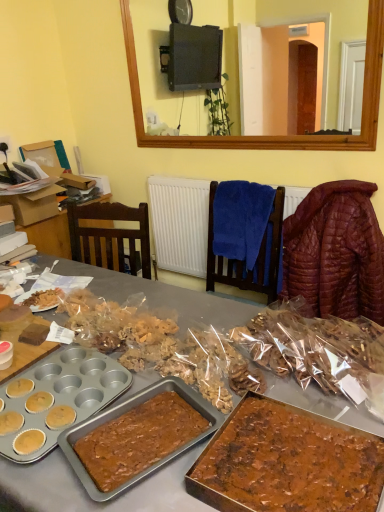
Identify the location of chocolatey brown cake at lower right. (288, 462).

Measure the distance between point [30,209] and camera.

Point [30,209] and camera are 7.08 feet apart.

What do you see at coordinates (336, 252) in the screenshot? This screenshot has height=512, width=384. I see `quilted brown jacket at right` at bounding box center [336, 252].

Image resolution: width=384 pixels, height=512 pixels. Describe the element at coordinates (243, 261) in the screenshot. I see `blue fabric chair at center` at that location.

Image resolution: width=384 pixels, height=512 pixels. In order to click on blue fabric chair at center in this screenshot , I will do `click(243, 261)`.

Locate an element on the screen. The image size is (384, 512). translucent plastic bag at center, placed as the first snack when sorted from left to right is located at coordinates (161, 346).

Measure the distance between blue fabric chair at center and translucent plastic cookies at center, arranged as the 1th snack when viewed from the right.

The distance of blue fabric chair at center from translucent plastic cookies at center, arranged as the 1th snack when viewed from the right, is 35.66 inches.

Is point (207, 272) less distant than point (376, 389)?

No, it is behind (376, 389).

Is blue fabric chair at center beside translucent plastic cookies at center, arranged as the 1th snack when viewed from the right?

No, blue fabric chair at center is not beside translucent plastic cookies at center, arranged as the 1th snack when viewed from the right.

Does blue fabric chair at center contain translucent plastic cookies at center, the second snack when ordered from left to right?

No, translucent plastic cookies at center, the second snack when ordered from left to right, is not inside blue fabric chair at center.

From a real-world perspective, does cardboard box at left sit lower than chocolatey brown cake at lower right?

Actually, cardboard box at left is physically above chocolatey brown cake at lower right in the real world.

Which is in front, point (35, 211) or point (277, 483)?

The point (277, 483) is closer to the camera.

Does cardboard box at left have a greater width compared to chocolatey brown cake at lower right?

Yes, cardboard box at left is wider than chocolatey brown cake at lower right.

Is cardboard box at left surrounding chocolatey brown cake at lower right?

No, chocolatey brown cake at lower right is not inside cardboard box at left.

From a real-world perspective, is cardboard box at left located beneath blue fabric chair at center?

No, from a real-world perspective, cardboard box at left is not under blue fabric chair at center.

Is cardboard box at left not inside blue fabric chair at center?

Indeed, cardboard box at left is completely outside blue fabric chair at center.

In order to click on chair below the cardboard box at left (from the image's perspective) in this screenshot , I will do `click(243, 261)`.

Can you confirm if cardboard box at left is smaller than blue fabric chair at center?

Incorrect, cardboard box at left is not smaller in size than blue fabric chair at center.

Do you think translucent plastic bag at center, placed as the first snack when sorted from left to right, is within cardboard box at left, or outside of it?

translucent plastic bag at center, placed as the first snack when sorted from left to right, is located beyond the bounds of cardboard box at left.

From a real-world perspective, count 2nd snacks downward from the cardboard box at left and point to it. Please provide its 2D coordinates.

[(161, 346)]

From the image's perspective, is translucent plastic bag at center, positioned as the 2th snack in right-to-left order, on cardboard box at left?

No, from the image's perspective, translucent plastic bag at center, positioned as the 2th snack in right-to-left order, is not over cardboard box at left.

Which object is positioned more to the left, translucent plastic bag at center, placed as the first snack when sorted from left to right, or cardboard box at left?

cardboard box at left.

Is blue fabric chair at center far from chocolatey brown cake at lower right?

Yes, blue fabric chair at center and chocolatey brown cake at lower right are located far from each other.

Does blue fabric chair at center contain chocolatey brown cake at lower right?

That's incorrect, chocolatey brown cake at lower right is not inside blue fabric chair at center.

How many degrees apart are the facing directions of blue fabric chair at center and chocolatey brown cake at lower right?

There is a 1.43-degree angle between the facing directions of blue fabric chair at center and chocolatey brown cake at lower right.

From a real-world perspective, which object rests below the other?

chocolatey brown cake at lower right, from a real-world perspective.

Does point (356, 280) lie behind point (102, 304)?

Yes, point (356, 280) is behind point (102, 304).

Consider the image. Is translucent plastic bag at center, placed as the first snack when sorted from left to right, inside quilted brown jacket at right?

Actually, translucent plastic bag at center, placed as the first snack when sorted from left to right, is outside quilted brown jacket at right.

Is quilted brown jacket at right oriented towards translucent plastic bag at center, positioned as the 2th snack in right-to-left order?

Yes, quilted brown jacket at right is turned towards translucent plastic bag at center, positioned as the 2th snack in right-to-left order.

How different are the orientations of quilted brown jacket at right and translucent plastic bag at center, positioned as the 2th snack in right-to-left order, in degrees?

The facing directions of quilted brown jacket at right and translucent plastic bag at center, positioned as the 2th snack in right-to-left order, are 4.8 degrees apart.

Which is behind, point (272, 295) or point (339, 184)?

The point (272, 295) is farther from the camera.

Is blue fabric chair at center looking in the opposite direction of quilted brown jacket at right?

No, quilted brown jacket at right is not at the back of blue fabric chair at center.

In terms of width, does blue fabric chair at center look wider or thinner when compared to quilted brown jacket at right?

Considering their sizes, blue fabric chair at center looks slimmer than quilted brown jacket at right.

Which object is positioned more to the right, blue fabric chair at center or quilted brown jacket at right?

From the viewer's perspective, quilted brown jacket at right appears more on the right side.

Image resolution: width=384 pixels, height=512 pixels. Find the location of `the 1st snack below the blue fabric chair at center (from the image's perspective)`. the 1st snack below the blue fabric chair at center (from the image's perspective) is located at coordinates (318, 352).

The height and width of the screenshot is (512, 384). Identify the location of box that is above the chocolatey brown cake at lower right (from a real-world perspective). (34, 203).

Estimate the real-world distances between objects in this image. Which object is further from translucent plastic cookies at center, the second snack when ordered from left to right, cardboard box at left or translucent plastic bag at center, placed as the first snack when sorted from left to right?

The object further to translucent plastic cookies at center, the second snack when ordered from left to right, is cardboard box at left.

Based on their spatial positions, is chocolatey brown cake at lower right or translucent plastic bag at center, positioned as the 2th snack in right-to-left order, further from cardboard box at left?

chocolatey brown cake at lower right is further to cardboard box at left.

Estimate the real-world distances between objects in this image. Which object is closer to blue fabric chair at center, translucent plastic cookies at center, arranged as the 1th snack when viewed from the right, or quilted brown jacket at right?

quilted brown jacket at right is positioned closer to the anchor blue fabric chair at center.

From the image, which object appears to be farther from translucent plastic bag at center, positioned as the 2th snack in right-to-left order, quilted brown jacket at right or blue fabric chair at center?

quilted brown jacket at right.

Which object lies further to the anchor point cardboard box at left, chocolatey brown cake at lower right or blue fabric chair at center?

chocolatey brown cake at lower right lies further to cardboard box at left than the other object.

Looking at the image, which one is located closer to blue fabric chair at center, chocolatey brown cake at lower right or translucent plastic bag at center, placed as the first snack when sorted from left to right?

translucent plastic bag at center, placed as the first snack when sorted from left to right.

Estimate the real-world distances between objects in this image. Which object is further from blue fabric chair at center, translucent plastic cookies at center, the second snack when ordered from left to right, or translucent plastic bag at center, placed as the first snack when sorted from left to right?

translucent plastic bag at center, placed as the first snack when sorted from left to right, lies further to blue fabric chair at center than the other object.

Estimate the real-world distances between objects in this image. Which object is closer to translucent plastic cookies at center, the second snack when ordered from left to right, translucent plastic bag at center, positioned as the 2th snack in right-to-left order, or cardboard box at left?

Among the two, translucent plastic bag at center, positioned as the 2th snack in right-to-left order, is located nearer to translucent plastic cookies at center, the second snack when ordered from left to right.

Find the location of `blanket located between translucent plastic cookies at center, the second snack when ordered from left to right, and blue fabric chair at center in the depth direction`. blanket located between translucent plastic cookies at center, the second snack when ordered from left to right, and blue fabric chair at center in the depth direction is located at coordinates (336, 252).

Locate an element on the screen. The image size is (384, 512). dessert between translucent plastic bag at center, positioned as the 2th snack in right-to-left order, and translucent plastic cookies at center, arranged as the 1th snack when viewed from the right, in the horizontal direction is located at coordinates (288, 462).

Find the location of a particular element. dessert between cardboard box at left and quilted brown jacket at right is located at coordinates (288, 462).

Where is `chair between cardboard box at left and quilted brown jacket at right from left to right`? chair between cardboard box at left and quilted brown jacket at right from left to right is located at coordinates (243, 261).